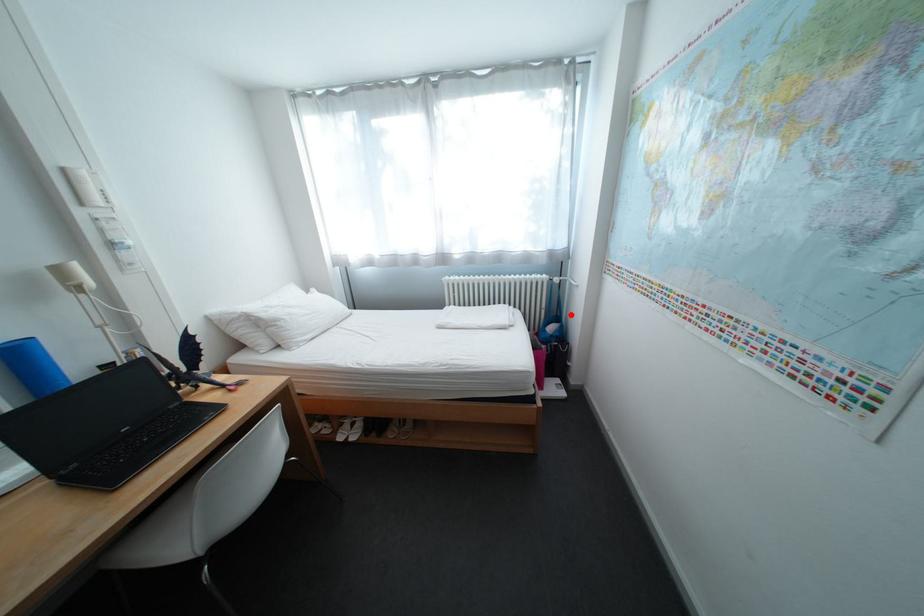
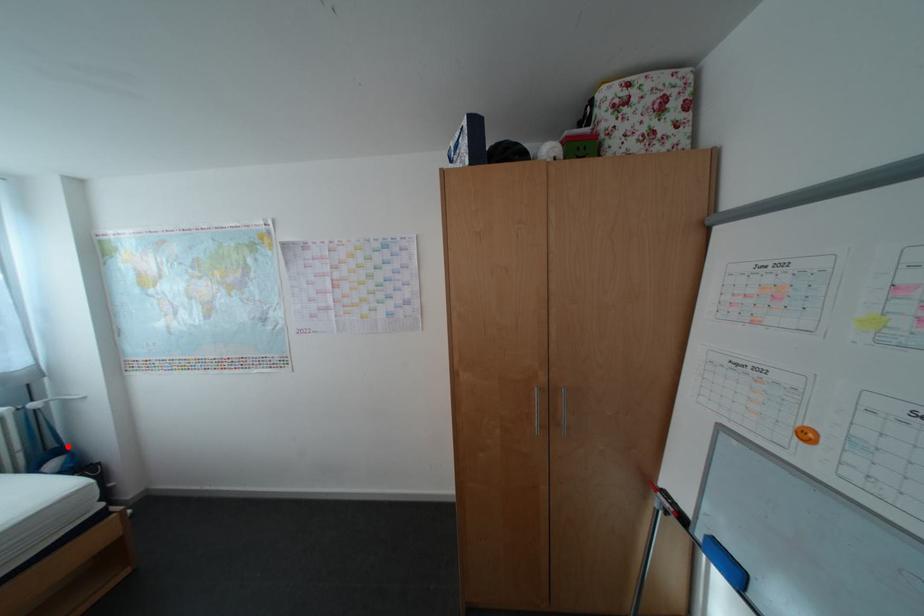
I am providing you with two images of the same scene from different viewpoints. A red point is marked on the first image and another point is marked on the second image. Are the points marked in image1 and image2 representing the same 3D position?

Yes